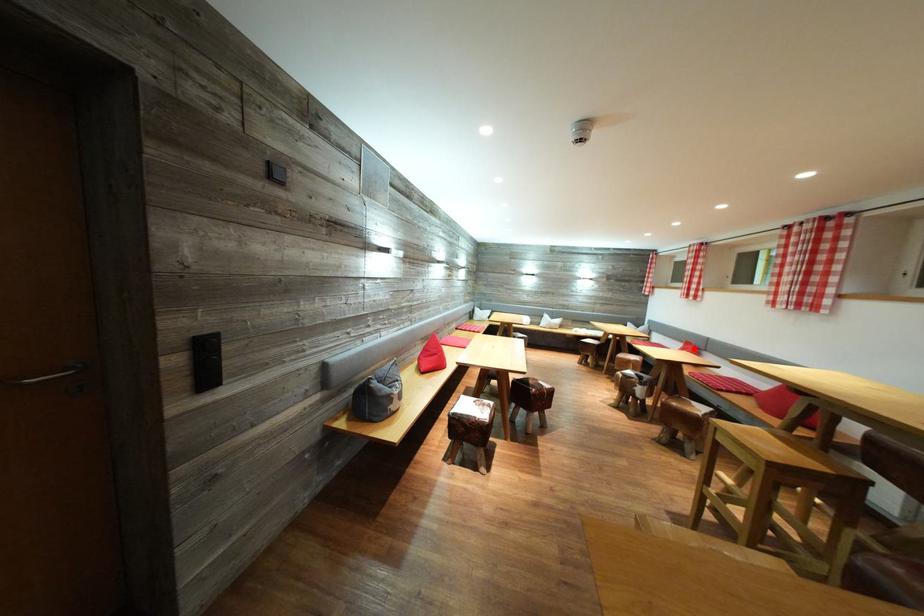
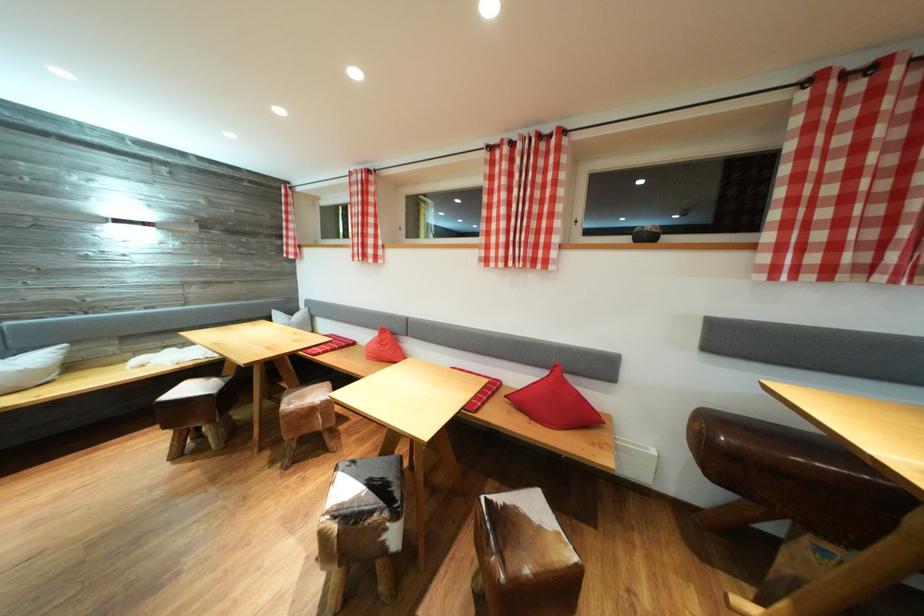
The point at the highlighted location is marked in the first image. Where is the corresponding point in the second image?

(390, 336)